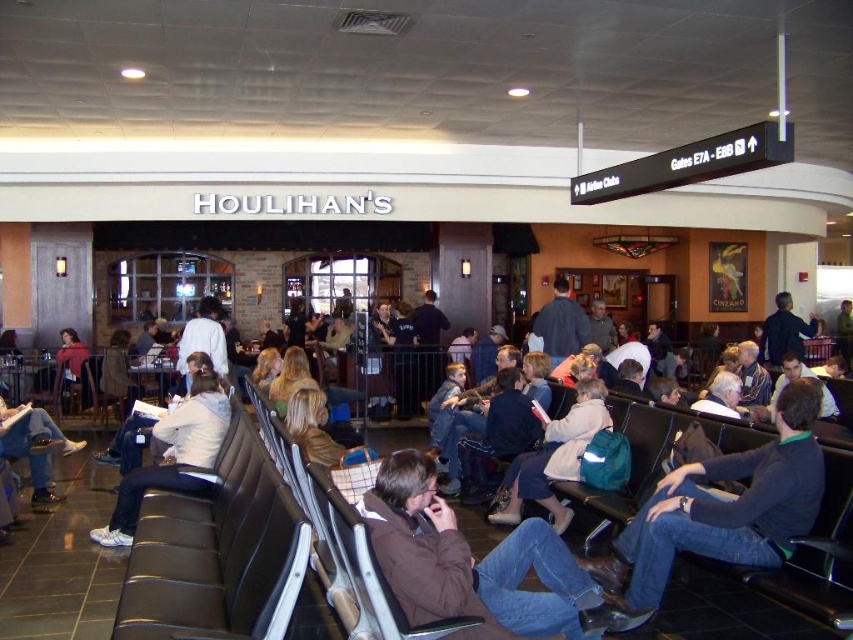
Question: Which is nearer to the white fabric jacket at center?

Choices:
 (A) dark blue shirt at center
 (B) white fleece jacket at center

Answer: (B)

Question: Estimate the real-world distances between objects in this image. Which object is farther from the dark brown leather jacket at center?

Choices:
 (A) white fabric jacket at center
 (B) dark blue shirt at center
 (C) black leather seat at center

Answer: (B)

Question: Does black leather seat at center have a greater width compared to brown leather jacket at center?

Choices:
 (A) yes
 (B) no

Answer: (A)

Question: From the image, what is the correct spatial relationship of black leather seat at center in relation to brown leather jacket at center?

Choices:
 (A) above
 (B) below

Answer: (B)

Question: Does brown leather jacket at center have a larger size compared to denim jacket at lower left?

Choices:
 (A) no
 (B) yes

Answer: (B)

Question: Which point is closer to the camera?

Choices:
 (A) dark brown leather jacket at center
 (B) black leather seat at center
 (C) white fabric jacket at center

Answer: (B)